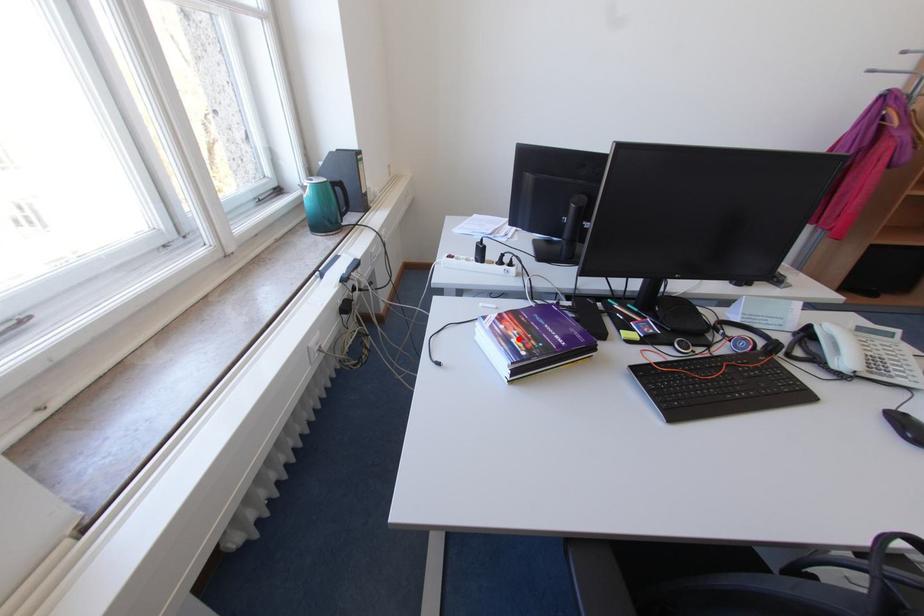
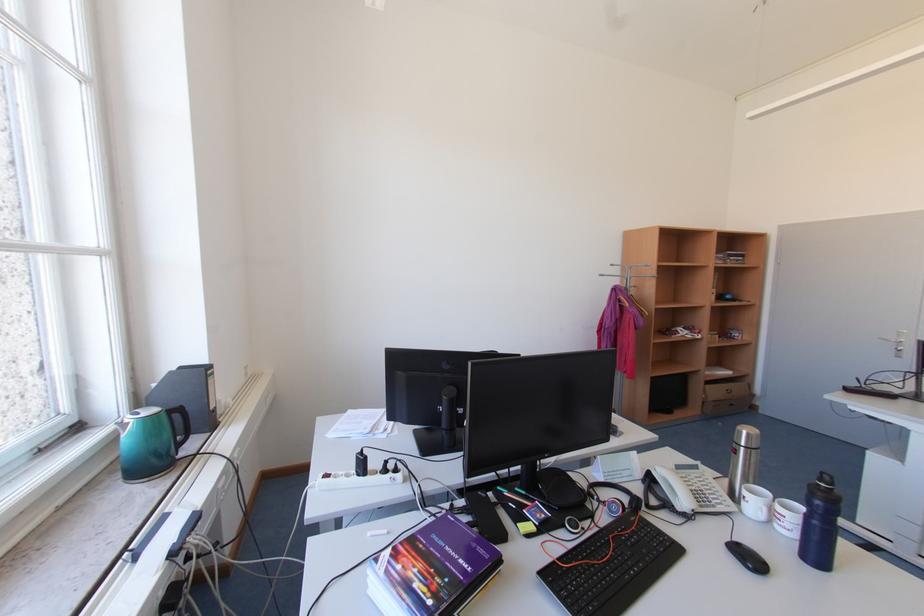
In the second image, find the point that corresponds to the highlighted location in the first image.

(419, 583)